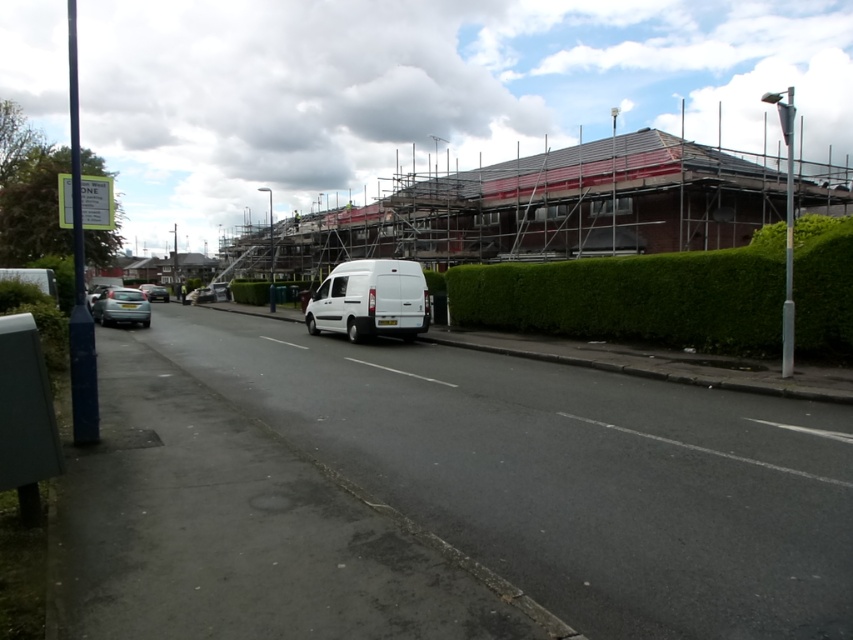
Question: Does white matte van at center have a smaller size compared to silver metallic car at center?

Choices:
 (A) no
 (B) yes

Answer: (B)

Question: Can you confirm if white matte van at center is positioned to the left of silver metallic car at center?

Choices:
 (A) no
 (B) yes

Answer: (A)

Question: Which point appears farthest from the camera in this image?

Choices:
 (A) (376, 316)
 (B) (144, 289)
 (C) (111, 308)

Answer: (B)

Question: Is green leafy hedge at center closer to camera compared to metallic silver car at lower left?

Choices:
 (A) yes
 (B) no

Answer: (A)

Question: Which point is farther to the camera?

Choices:
 (A) (112, 305)
 (B) (149, 285)

Answer: (B)

Question: Which point is closer to the camera taking this photo?

Choices:
 (A) (119, 301)
 (B) (838, 308)
 (C) (375, 323)
 (D) (152, 298)

Answer: (B)